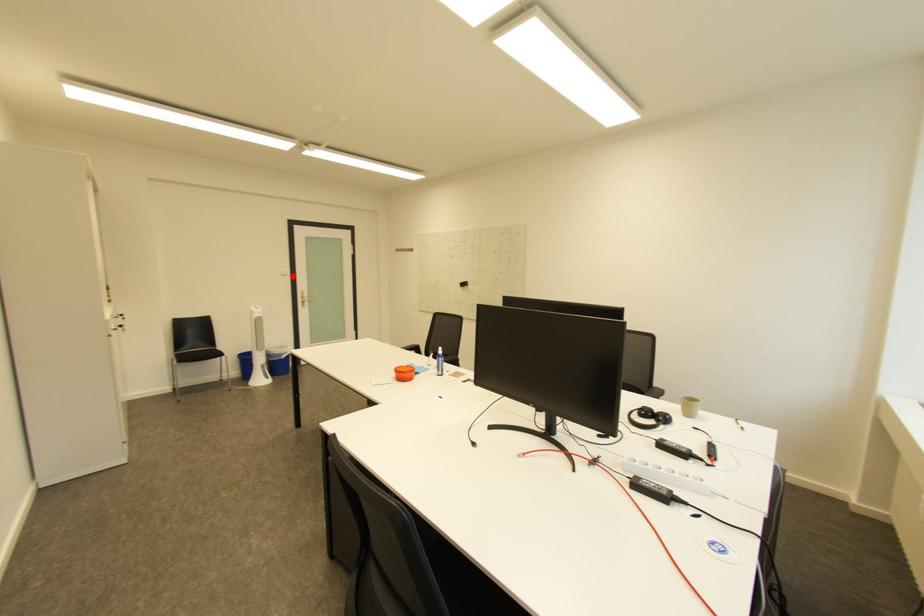
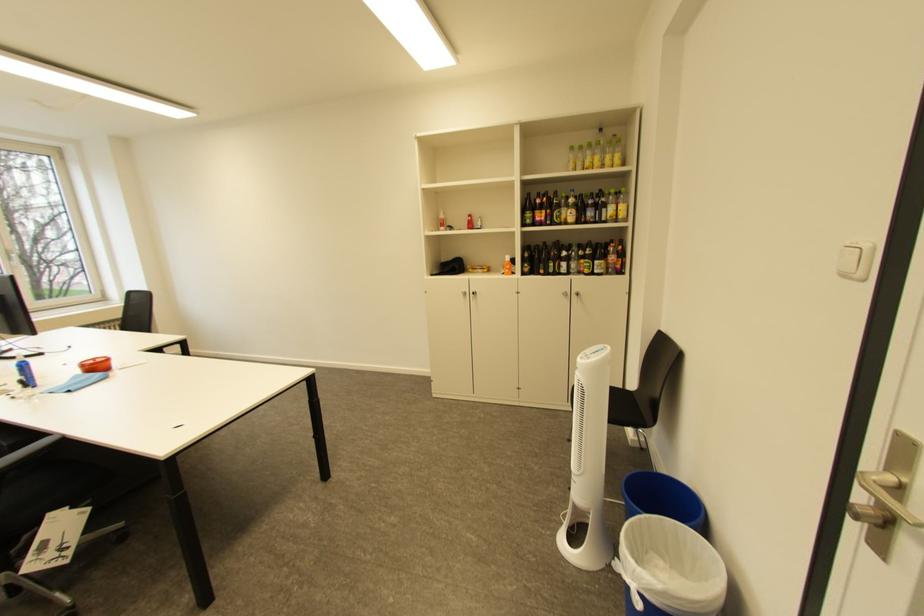
Question: I am providing you with two images of the same scene from different viewpoints. A red point is shown in image1. For the corresponding object point in image2, is it positioned nearer or farther from the camera?

Choices:
 (A) Nearer
 (B) Farther

Answer: (B)